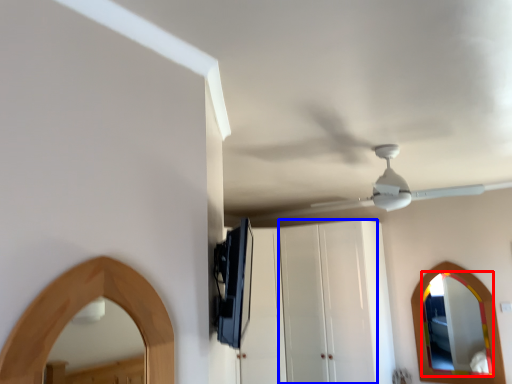
Question: Which object is further to the camera taking this photo, mirror (highlighted by a red box) or glass door (highlighted by a blue box)?

Choices:
 (A) mirror
 (B) glass door

Answer: (B)